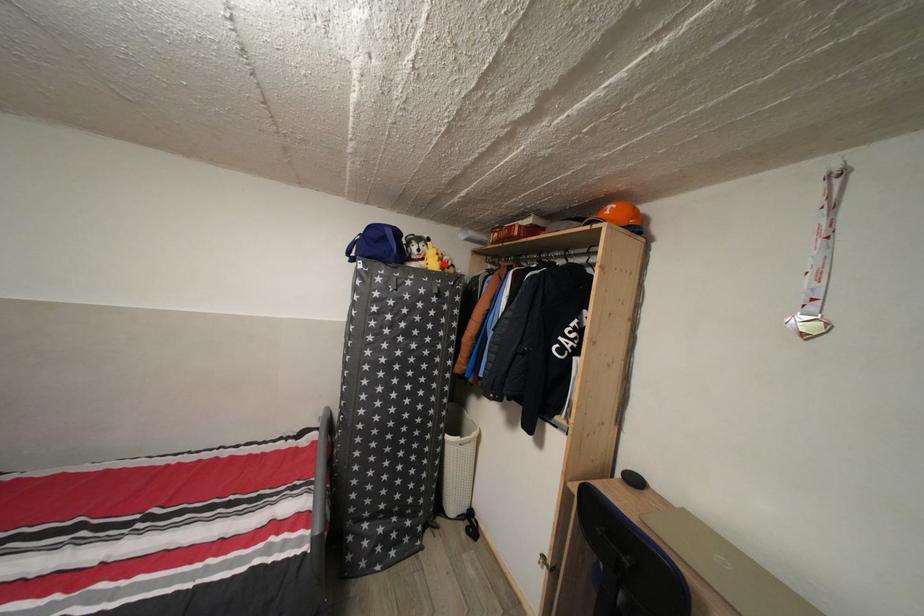
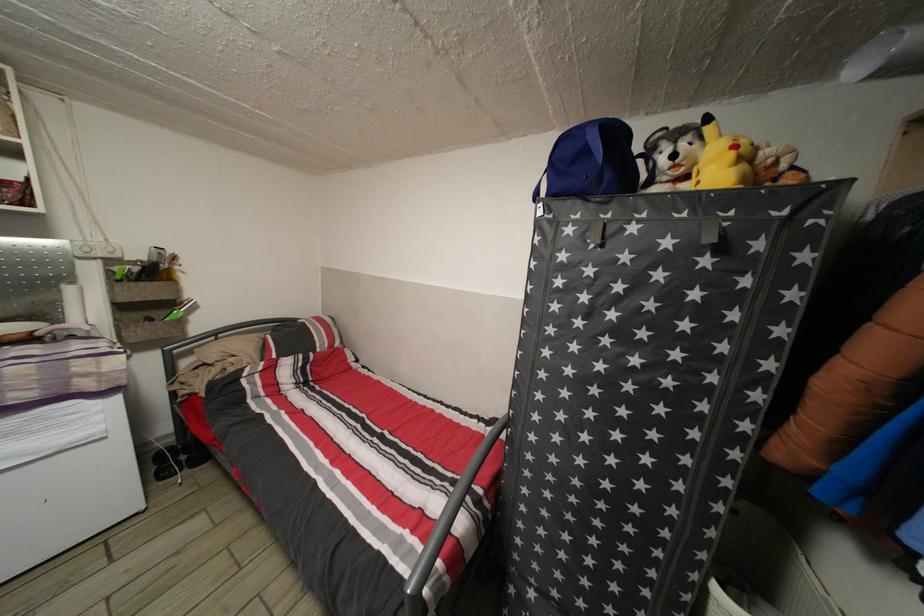
Find the pixel in the second image that matches the highlighted location in the first image.

(738, 161)